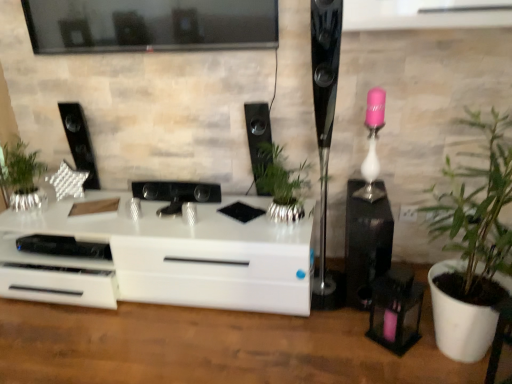
The image size is (512, 384). I want to click on vacant region under silver metallic plant pot at center, the second houseplant in the right-to-left sequence (from a real-world perspective), so point(274,228).